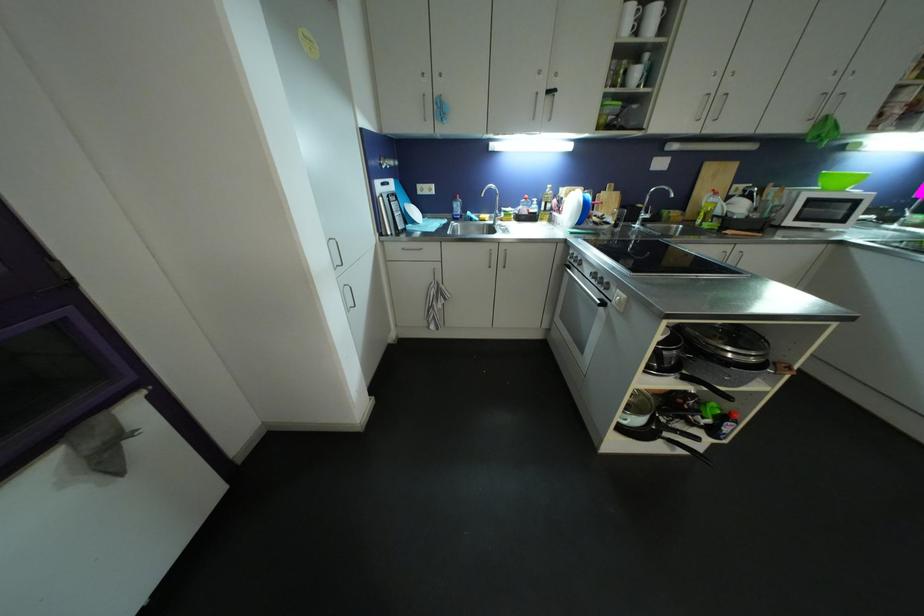
I want to click on faucet handle, so click(x=492, y=200).